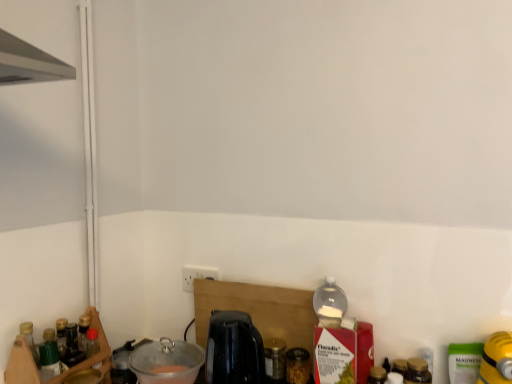
Question: Do you think transparent glass jar at center, the 3th bottle viewed from the right, is within black glossy coffee machine at center, or outside of it?

Choices:
 (A) inside
 (B) outside

Answer: (B)

Question: Is transparent glass jar at center, acting as the first bottle starting from the left, wider or thinner than black glossy coffee machine at center?

Choices:
 (A) wide
 (B) thin

Answer: (B)

Question: Based on their relative distances, which object is nearer to the metallic black kettle at lower left, arranged as the 3th appliance when viewed from the right?

Choices:
 (A) clear plastic bowl at lower left, acting as the second appliance starting from the left
 (B) black glossy coffee machine at center
 (C) translucent glass jar at center, which ranks as the 2th bottle in right-to-left order
 (D) transparent glass jar at center, the 3th bottle viewed from the right
 (E) brown glass jar at lower right, the first bottle in the front-to-back sequence

Answer: (A)

Question: Which is nearer to the translucent glass jar at center, which is the 2th bottle from front to back?

Choices:
 (A) black glossy coffee machine at center
 (B) brown glass jar at lower right, the first bottle when ordered from right to left
 (C) yellow rubber glove at lower right, which is counted as the 3th appliance, starting from the left
 (D) clear plastic bowl at lower left, the second appliance positioned from the right
 (E) transparent glass jar at center, acting as the first bottle starting from the left

Answer: (E)